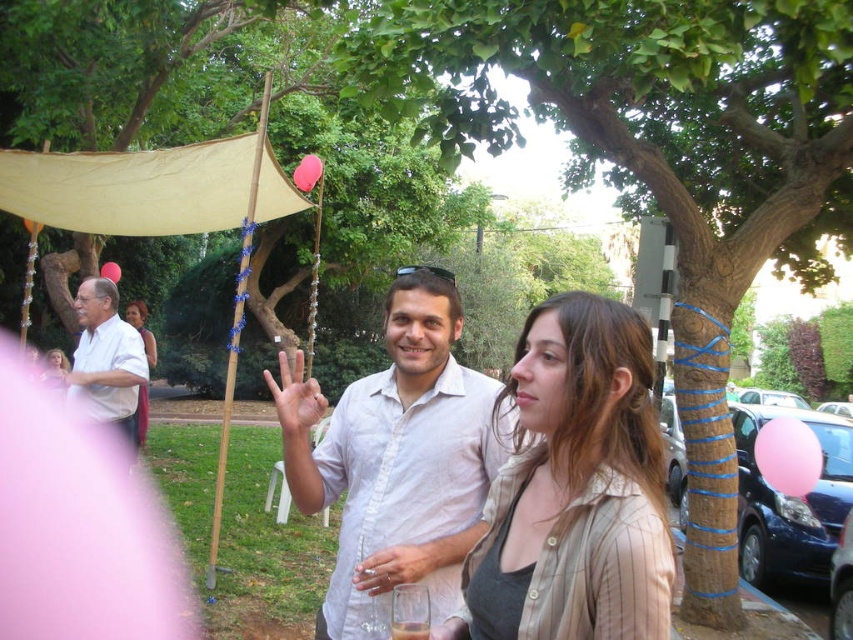
Measure the distance between matte beige shirt at center and white cotton shirt at center.

matte beige shirt at center and white cotton shirt at center are 14.76 inches apart from each other.

Based on the photo, how far apart are matte beige shirt at center and white cotton shirt at center?

The distance of matte beige shirt at center from white cotton shirt at center is 14.76 inches.

Locate an element on the screen. matte beige shirt at center is located at coordinates (575, 488).

Identify the location of matte beige shirt at center. (575, 488).

Measure the distance between point (496, 624) and camera.

Point (496, 624) is 1.14 meters from camera.

Does matte beige shirt at center appear on the left side of white matte shirt at left?

In fact, matte beige shirt at center is to the right of white matte shirt at left.

Describe the element at coordinates (575, 488) in the screenshot. The height and width of the screenshot is (640, 853). I see `matte beige shirt at center` at that location.

The height and width of the screenshot is (640, 853). I want to click on matte beige shirt at center, so click(575, 488).

What do you see at coordinates (106, 360) in the screenshot? The height and width of the screenshot is (640, 853). I see `white matte shirt at left` at bounding box center [106, 360].

Does white matte shirt at left appear under pink latex balloon at upper center?

Yes.

Does point (97, 323) come in front of point (117, 280)?

Yes, it is.

Find the location of a particular element. white matte shirt at left is located at coordinates (106, 360).